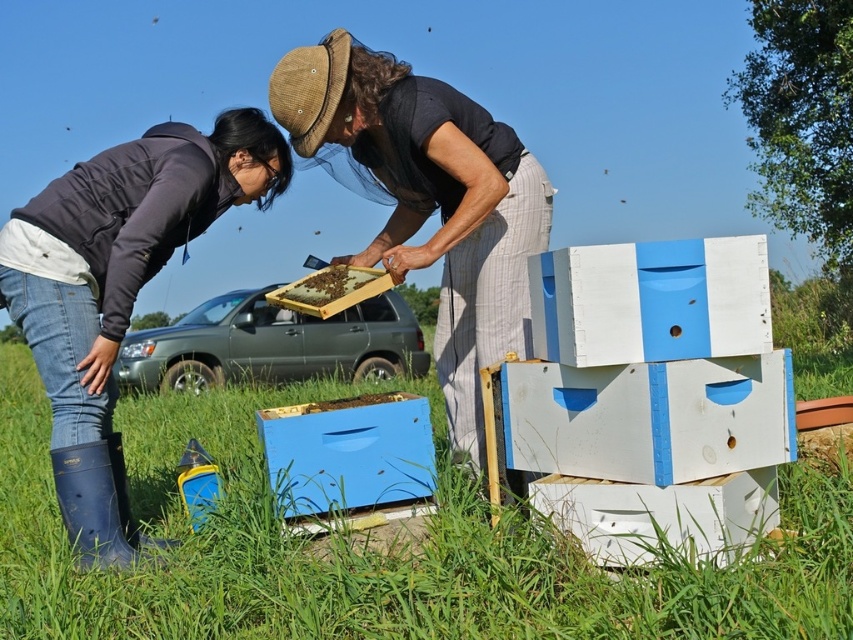
Does matte black shirt at center lie in front of blue painted wooden beehive at lower center?

That is True.

Who is more forward, (405, 234) or (419, 422)?

Point (419, 422)

Is point (392, 192) behind point (403, 452)?

Yes, it is behind point (403, 452).

Locate an element on the screen. matte black shirt at center is located at coordinates (428, 202).

Is dark gray jacket at lower left taller than blue painted wooden beehive at lower center?

Correct, dark gray jacket at lower left is much taller as blue painted wooden beehive at lower center.

Is point (56, 381) farther from camera compared to point (277, 464)?

No, it is in front of (277, 464).

Identify the location of dark gray jacket at lower left. (117, 289).

Is dark gray jacket at lower left to the left of wooden frame at center from the viewer's perspective?

Correct, you'll find dark gray jacket at lower left to the left of wooden frame at center.

Who is positioned more to the right, dark gray jacket at lower left or wooden frame at center?

From the viewer's perspective, wooden frame at center appears more on the right side.

Is point (128, 220) positioned in front of point (340, 307)?

Yes, it is in front of point (340, 307).

What are the coordinates of `dark gray jacket at lower left` in the screenshot? It's located at (x=117, y=289).